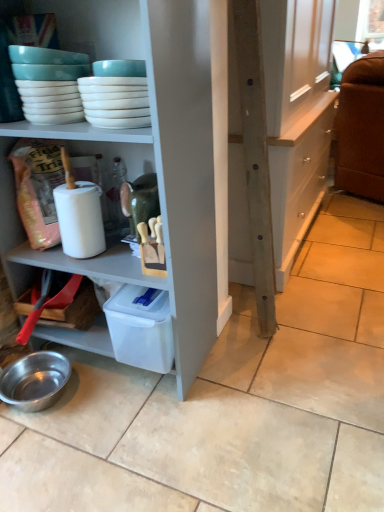
You are a GUI agent. You are given a task and a screenshot of the screen. Output one action in this format:
    pyautogui.click(x=<x>, y=<y>)
    Task: Click on the white glossy bowls at upper left
    
    Given the screenshot: What is the action you would take?
    pyautogui.click(x=49, y=83)

Where is `wooden cabinet at center`? wooden cabinet at center is located at coordinates (296, 116).

Is shiny metallic bowl at lower left positioned with its back to white glossy bowls at upper left?

No, white glossy bowls at upper left is not at the back of shiny metallic bowl at lower left.

Who is smaller, shiny metallic bowl at lower left or white glossy bowls at upper left?

Smaller between the two is white glossy bowls at upper left.

From the image's perspective, which is above, shiny metallic bowl at lower left or white glossy bowls at upper left?

white glossy bowls at upper left is shown above in the image.

From a real-world perspective, is shiny metallic bowl at lower left on white glossy bowls at upper left?

No, from a real-world perspective, shiny metallic bowl at lower left is not over white glossy bowls at upper left

Is white glossy bowls at upper left in contact with shiny metallic bowl at lower left?

No, white glossy bowls at upper left is not touching shiny metallic bowl at lower left.

Is white glossy bowls at upper left to the left of shiny metallic bowl at lower left from the viewer's perspective?

In fact, white glossy bowls at upper left is to the right of shiny metallic bowl at lower left.

From the image's perspective, who appears lower, white glossy bowls at upper left or shiny metallic bowl at lower left?

shiny metallic bowl at lower left appears lower in the image.

Looking at this image, is shiny metallic bowl at lower left at the back of white glossy bowls at upper left?

No, shiny metallic bowl at lower left is not at the back of white glossy bowls at upper left.

Which object is positioned more to the left, white glossy bowls at upper left or wooden cabinet at center?

white glossy bowls at upper left is more to the left.

Is white glossy bowls at upper left not within wooden cabinet at center?

white glossy bowls at upper left is positioned outside wooden cabinet at center.

Is white glossy bowls at upper left positioned with its back to wooden cabinet at center?

Absolutely, white glossy bowls at upper left is directed away from wooden cabinet at center.

Who is more distant, white glossy bowls at upper left or wooden cabinet at center?

Positioned behind is wooden cabinet at center.

Could you tell me if shiny metallic bowl at lower left is facing wooden cabinet at center?

No.

Considering the sizes of objects shiny metallic bowl at lower left and wooden cabinet at center in the image provided, who is shorter, shiny metallic bowl at lower left or wooden cabinet at center?

With less height is shiny metallic bowl at lower left.

The image size is (384, 512). I want to click on bowl to the left of wooden cabinet at center, so click(x=35, y=380).

Looking at this image, in the image, is shiny metallic bowl at lower left on the left side or the right side of wooden cabinet at center?

From the image, it's evident that shiny metallic bowl at lower left is to the left of wooden cabinet at center.

Considering the relative sizes of wooden cabinet at center and white glossy bowls at upper left in the image provided, is wooden cabinet at center bigger than white glossy bowls at upper left?

Correct, wooden cabinet at center is larger in size than white glossy bowls at upper left.

Would you say wooden cabinet at center is to the left or to the right of white glossy bowls at upper left in the picture?

wooden cabinet at center is positioned on white glossy bowls at upper left's right side.

From the image's perspective, does wooden cabinet at center appear lower than white glossy bowls at upper left?

No.

Between wooden cabinet at center and white glossy bowls at upper left, which one has less height?

With less height is white glossy bowls at upper left.

Is wooden cabinet at center at the left side of shiny metallic bowl at lower left?

Incorrect, wooden cabinet at center is not on the left side of shiny metallic bowl at lower left.

Is wooden cabinet at center not within shiny metallic bowl at lower left?

Yes, wooden cabinet at center is located beyond the bounds of shiny metallic bowl at lower left.

Is wooden cabinet at center taller than shiny metallic bowl at lower left?

Indeed, wooden cabinet at center has a greater height compared to shiny metallic bowl at lower left.

In the image, there is a white glossy bowls at upper left. What are the coordinates of `bowl below it (from the image's perspective)` in the screenshot? It's located at pos(35,380).

This screenshot has width=384, height=512. I want to click on tableware in front of the shiny metallic bowl at lower left, so click(x=49, y=83).

Based on their spatial positions, is wooden cabinet at center or white glossy bowls at upper left closer to shiny metallic bowl at lower left?

white glossy bowls at upper left is closer to shiny metallic bowl at lower left.

When comparing their distances from shiny metallic bowl at lower left, does white glossy bowls at upper left or wooden cabinet at center seem closer?

white glossy bowls at upper left lies closer to shiny metallic bowl at lower left than the other object.

Estimate the real-world distances between objects in this image. Which object is further from white glossy bowls at upper left, wooden cabinet at center or shiny metallic bowl at lower left?

wooden cabinet at center is positioned further to the anchor white glossy bowls at upper left.

Which object lies nearer to the anchor point wooden cabinet at center, white glossy bowls at upper left or shiny metallic bowl at lower left?

white glossy bowls at upper left is closer to wooden cabinet at center.

Based on their spatial positions, is shiny metallic bowl at lower left or wooden cabinet at center closer to white glossy bowls at upper left?

shiny metallic bowl at lower left lies closer to white glossy bowls at upper left than the other object.

From the image, which object appears to be farther from wooden cabinet at center, shiny metallic bowl at lower left or white glossy bowls at upper left?

shiny metallic bowl at lower left is further to wooden cabinet at center.

Find the location of a particular element. This screenshot has height=512, width=384. tableware between wooden cabinet at center and shiny metallic bowl at lower left vertically is located at coordinates (49, 83).